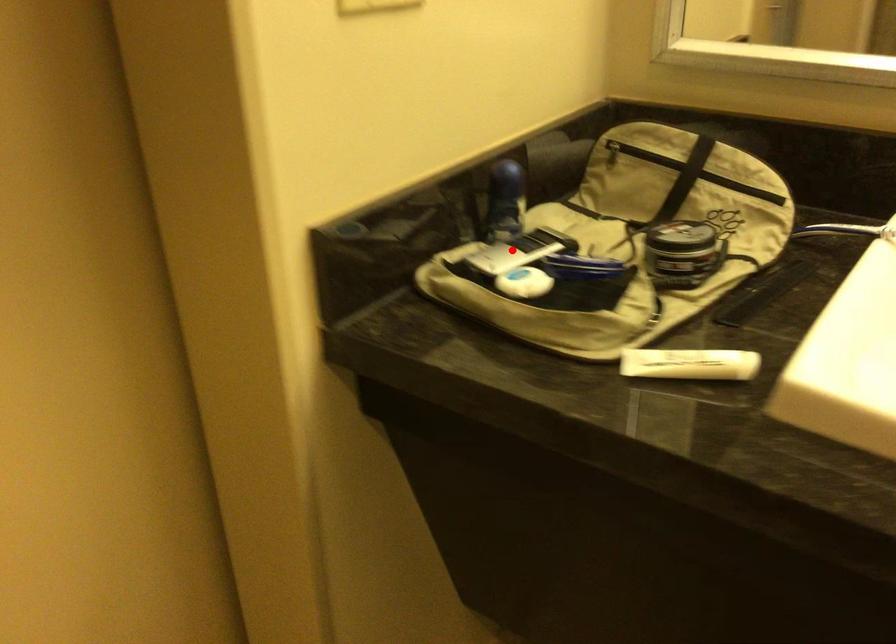
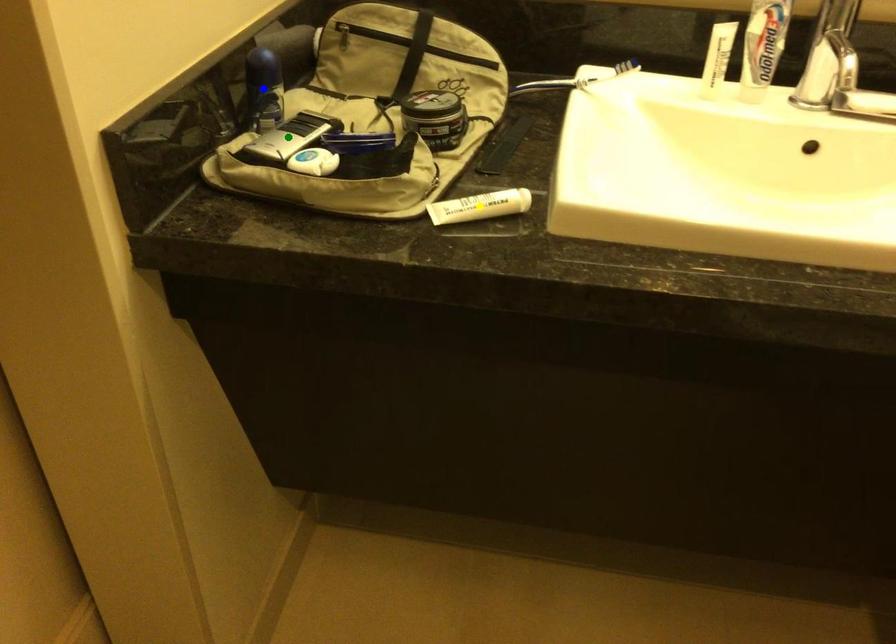
Question: I am providing you with two images of the same scene from different viewpoints. A red point is marked on the first image. You are given multiple points on the second image. Which point in image 2 represents the same 3d spot as the red point in image 1?

Choices:
 (A) green point
 (B) blue point
 (C) yellow point

Answer: (A)